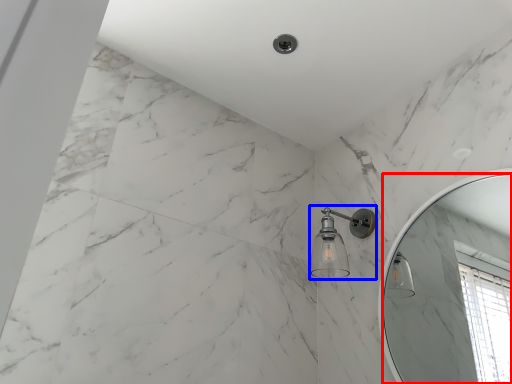
Question: Which object is further to the camera taking this photo, mirror (highlighted by a red box) or shower (highlighted by a blue box)?

Choices:
 (A) mirror
 (B) shower

Answer: (B)